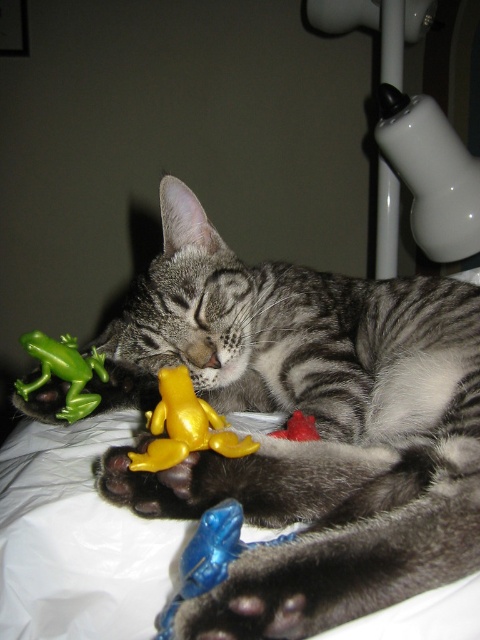
You are a pet owner who wants to place a small decorative vase between the yellow rubber frog at center and the green matte frog at left. Which frog should the vase be closer to if the vase is 2 inches tall?

The yellow rubber frog at center has a lesser height compared to the green matte frog at left. Since the vase is 2 inches tall, it should be placed closer to the yellow rubber frog at center to avoid blocking the view of the taller green matte frog at left.

You are taking a photo of the tabby cat and notice two points in the image labeled as point (189, 429) and point (58, 365). Which point is nearer to the camera?

Point (189, 429) is closer to the camera than point (58, 365) according to the description.

You are a photographer trying to capture a closeup of the tabby cat in the image. You need to adjust your camera focus to ensure both points, point(106, 346) and point(201, 529) are in focus. Which point should you focus on first to ensure the closest point is sharp?

You should focus on point(106, 346) first because it is closer to the camera than point(201, 529), ensuring the closest point is sharp before adjusting for the farther one.